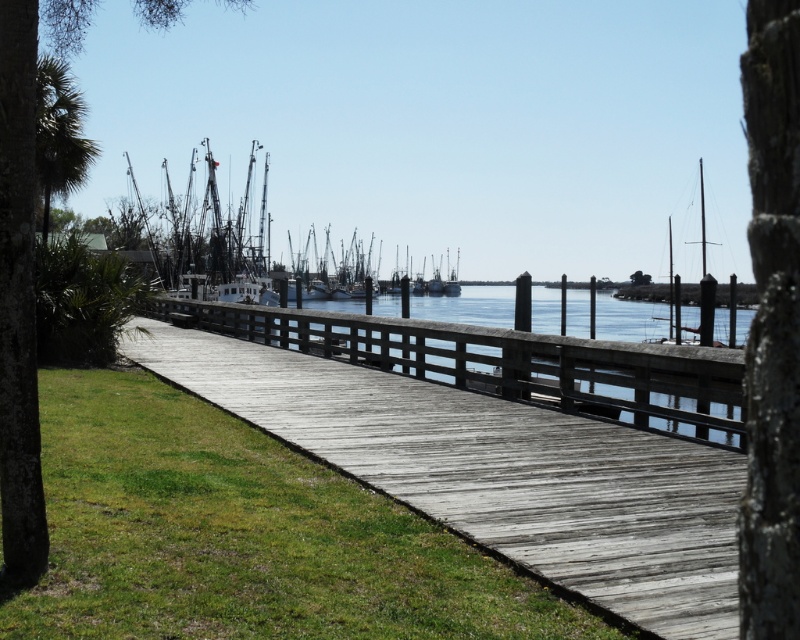
You are a photographer standing on the wooden boardwalk and want to capture both the green grass at lower left and the white matte boat at center in your shot. Which object will appear closer to the bottom edge of your photo?

The green grass at lower left will appear closer to the bottom edge of your photo because it is shorter than the white matte boat at center.

You are a photographer planning to capture the white matte boat at center and the green leafy palm tree at upper left in the same frame. Based on their heights, which object will appear larger in the photo?

The white matte boat at center will appear larger in the photo because it is much taller than the green leafy palm tree at upper left.